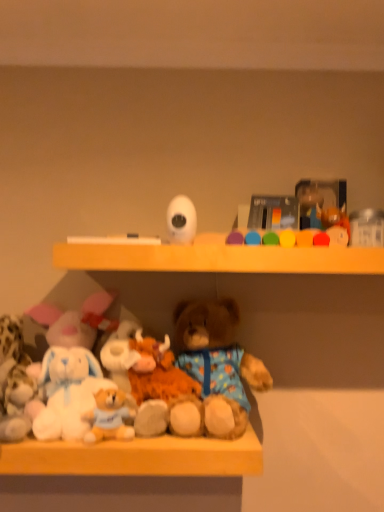
Question: Is the depth of fluffy white stuffed animal at lower left, arranged as the 4th toy when viewed from the right, greater than that of white plush toys at lower center?

Choices:
 (A) no
 (B) yes

Answer: (B)

Question: Is fluffy white stuffed animal at lower left, the second toy positioned from the bottom, turned away from white plush toys at lower center?

Choices:
 (A) no
 (B) yes

Answer: (A)

Question: Could you tell me if fluffy white stuffed animal at lower left, the second toy positioned from the bottom, is facing white plush toys at lower center?

Choices:
 (A) no
 (B) yes

Answer: (A)

Question: Does fluffy white stuffed animal at lower left, acting as the first toy starting from the left, have a greater height compared to white plush toys at lower center?

Choices:
 (A) no
 (B) yes

Answer: (B)

Question: From the image's perspective, is fluffy white stuffed animal at lower left, arranged as the 4th toy when viewed from the right, on top of white plush toys at lower center?

Choices:
 (A) no
 (B) yes

Answer: (B)

Question: Is fluffy white stuffed animal at lower left, arranged as the 4th toy when viewed from the right, completely or partially outside of white plush toys at lower center?

Choices:
 (A) no
 (B) yes

Answer: (B)

Question: Is white matte camera at upper center, acting as the fourth toy starting from the bottom, in front of fluffy white stuffed animal at lower left, the third toy from the top?

Choices:
 (A) yes
 (B) no

Answer: (A)

Question: Considering the relative sizes of white matte camera at upper center, the first toy positioned from the top, and fluffy white stuffed animal at lower left, the second toy positioned from the bottom, in the image provided, is white matte camera at upper center, the first toy positioned from the top, wider than fluffy white stuffed animal at lower left, the second toy positioned from the bottom,?

Choices:
 (A) yes
 (B) no

Answer: (B)

Question: Is white matte camera at upper center, the first toy positioned from the top, bigger than fluffy white stuffed animal at lower left, arranged as the 4th toy when viewed from the right?

Choices:
 (A) no
 (B) yes

Answer: (A)

Question: From a real-world perspective, is white matte camera at upper center, positioned as the second toy in right-to-left order, positioned under fluffy white stuffed animal at lower left, the third toy from the top, based on gravity?

Choices:
 (A) yes
 (B) no

Answer: (B)

Question: From a real-world perspective, is white matte camera at upper center, the first toy positioned from the top, over fluffy white stuffed animal at lower left, arranged as the 4th toy when viewed from the right?

Choices:
 (A) no
 (B) yes

Answer: (B)

Question: From the image's perspective, is white matte camera at upper center, acting as the fourth toy starting from the bottom, over fluffy white stuffed animal at lower left, the second toy positioned from the bottom?

Choices:
 (A) yes
 (B) no

Answer: (A)

Question: Considering the relative sizes of fluffy brown teddy bear at center and white matte camera at upper center, positioned as the second toy in right-to-left order, in the image provided, is fluffy brown teddy bear at center bigger than white matte camera at upper center, positioned as the second toy in right-to-left order,?

Choices:
 (A) yes
 (B) no

Answer: (A)